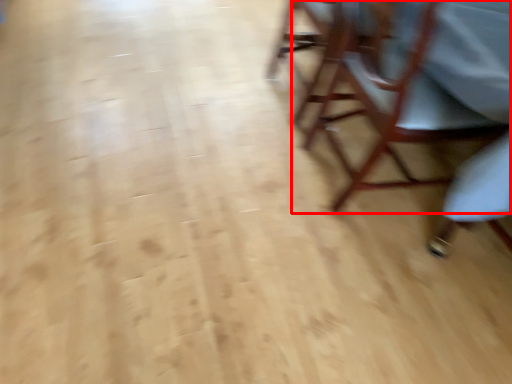
Question: From the image's perspective, where is chair (annotated by the red box) located relative to chair?

Choices:
 (A) above
 (B) below

Answer: (B)